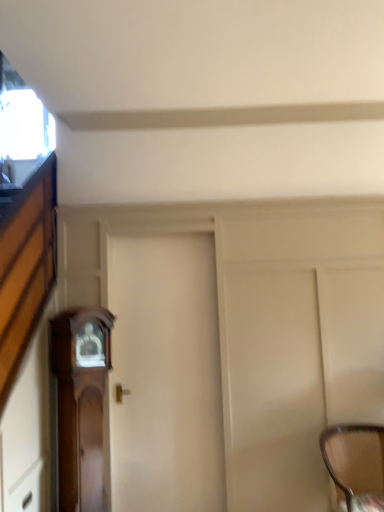
Question: In the image, is white matte door at center positioned in front of or behind wooden grandfather clock at left?

Choices:
 (A) front
 (B) behind

Answer: (B)

Question: Is point (221, 431) positioned closer to the camera than point (74, 428)?

Choices:
 (A) farther
 (B) closer

Answer: (A)

Question: Which object is the farthest from the woven fabric chair at lower right?

Choices:
 (A) wooden grandfather clock at left
 (B) white matte door at center
 (C) wooden drawer at lower left

Answer: (C)

Question: Which is farther from the white matte door at center?

Choices:
 (A) wooden grandfather clock at left
 (B) woven fabric chair at lower right
 (C) wooden drawer at lower left

Answer: (B)